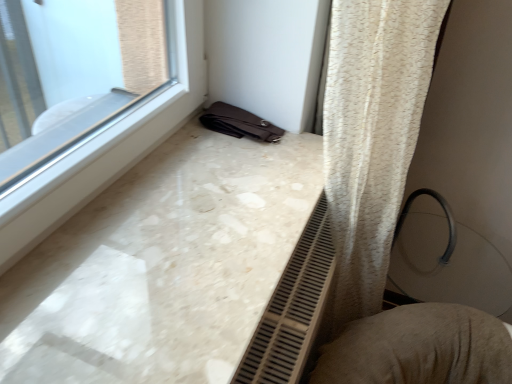
Question: From the image's perspective, is textured beige cushion at lower right located above or below white marble counter top at lower left?

Choices:
 (A) above
 (B) below

Answer: (B)

Question: Is point (x=420, y=304) positioned closer to the camera than point (x=135, y=195)?

Choices:
 (A) closer
 (B) farther

Answer: (B)

Question: Is textured beige cushion at lower right wider or thinner than white marble counter top at lower left?

Choices:
 (A) wide
 (B) thin

Answer: (B)

Question: Considering the positions of white marble counter top at lower left and textured beige cushion at lower right in the image, is white marble counter top at lower left wider or thinner than textured beige cushion at lower right?

Choices:
 (A) thin
 (B) wide

Answer: (B)

Question: Considering the relative positions of white marble counter top at lower left and textured beige cushion at lower right in the image provided, is white marble counter top at lower left to the left or to the right of textured beige cushion at lower right?

Choices:
 (A) right
 (B) left

Answer: (B)

Question: Does point (196, 278) appear closer or farther from the camera than point (391, 375)?

Choices:
 (A) farther
 (B) closer

Answer: (B)

Question: Considering their positions, is white marble counter top at lower left located in front of or behind textured beige cushion at lower right?

Choices:
 (A) behind
 (B) front

Answer: (B)